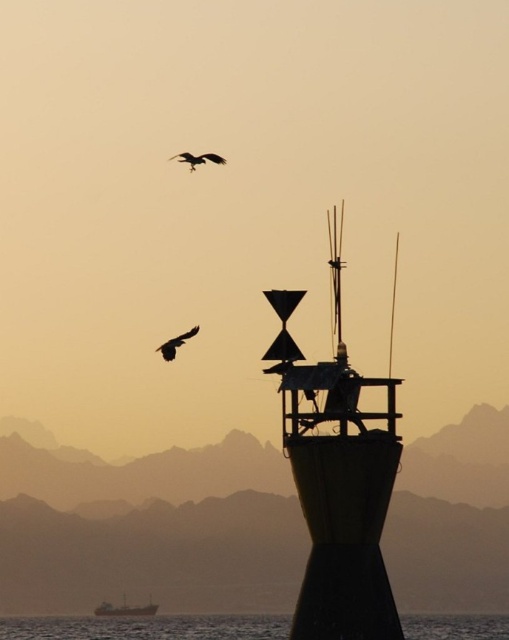
At what (x,y) coordinates should I click in order to perform the action: click on green matte tower at center. Please return your answer as a coordinate pair (x, y). The image size is (509, 640). Looking at the image, I should click on (338, 477).

Does point (279, 392) lie behind point (137, 605)?

No, it is in front of (137, 605).

I want to click on green matte tower at center, so click(x=338, y=477).

Is point (147, 611) positioned in front of point (184, 339)?

That is False.

What do you see at coordinates (126, 609) in the screenshot?
I see `metallic gray boat at lower left` at bounding box center [126, 609].

Locate an element on the screen. This screenshot has width=509, height=640. metallic gray boat at lower left is located at coordinates (126, 609).

Where is `metallic gray boat at lower left`? metallic gray boat at lower left is located at coordinates [x=126, y=609].

Is metallic gray boat at lower left smaller than silhouette feathered bird at upper center?

Correct, metallic gray boat at lower left occupies less space than silhouette feathered bird at upper center.

Is metallic gray boat at lower left to the right of silhouette feathered bird at upper center from the viewer's perspective?

Incorrect, metallic gray boat at lower left is not on the right side of silhouette feathered bird at upper center.

Is point (138, 611) positioned after point (183, 160)?

Yes, point (138, 611) is farther from viewer.

Where is `metallic gray boat at lower left`? The height and width of the screenshot is (640, 509). metallic gray boat at lower left is located at coordinates (126, 609).